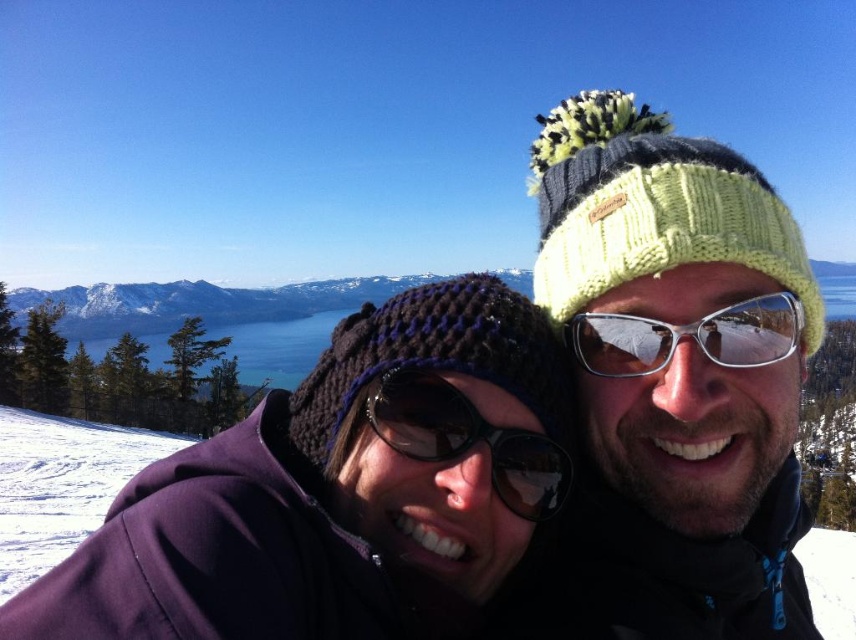
You are a photographer trying to capture the purple knitted beanie at center in the image. According to the coordinates provided, where exactly should you focus your camera lens to ensure the beanie is in the center of your shot?

To capture the purple knitted beanie at center, focus your camera lens at the coordinates point (342,492) as specified.

You are a photographer trying to capture a closeup shot of the knitted yellow hat at center and the black reflective sunglasses at center. Since you want to ensure both are in focus, you need to know which object is wider. Which one is wider?

The knitted yellow hat at center is wider than the black reflective sunglasses at center according to the description.